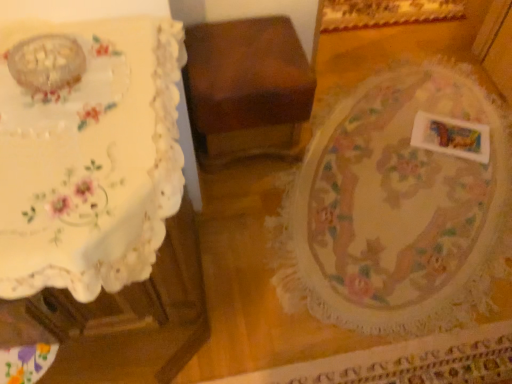
Question: Would you say floral lace tablecloth at center is to the left or to the right of white matte rectangular object at lower right in the picture?

Choices:
 (A) right
 (B) left

Answer: (B)

Question: Is floral lace tablecloth at center wider or thinner than white matte rectangular object at lower right?

Choices:
 (A) thin
 (B) wide

Answer: (B)

Question: Which of these objects is positioned farthest from the floral lace tablecloth at center?

Choices:
 (A) white lace tablecloth at left
 (B) white matte rectangular object at lower right
 (C) wooden box at center

Answer: (A)

Question: Which object is the closest to the white matte rectangular object at lower right?

Choices:
 (A) white lace tablecloth at left
 (B) wooden box at center
 (C) floral lace tablecloth at center

Answer: (C)